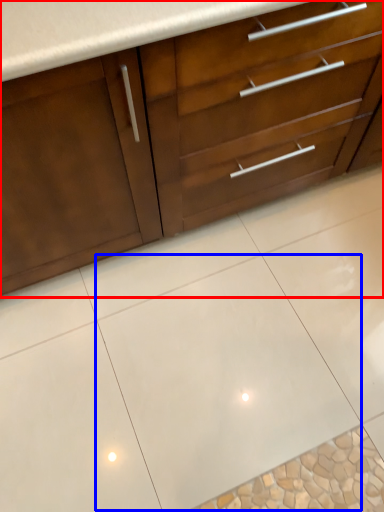
Question: Which point is further to the camera, cabinetry (highlighted by a red box) or ceramic tile (highlighted by a blue box)?

Choices:
 (A) cabinetry
 (B) ceramic tile

Answer: (B)